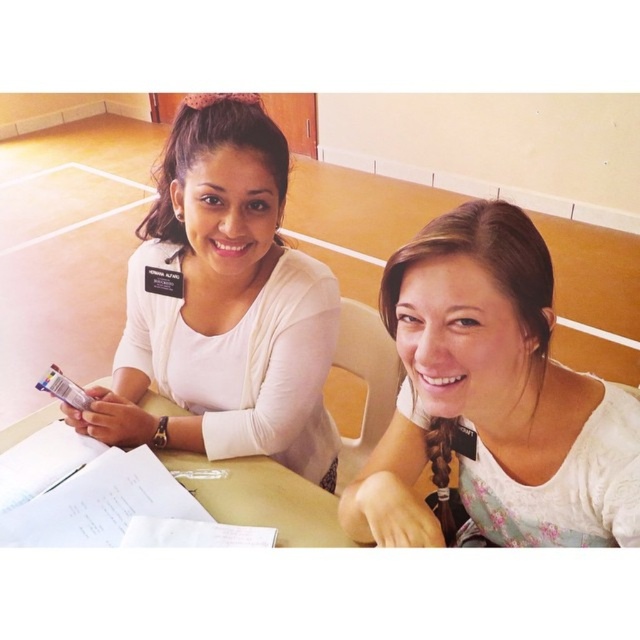
Question: Can you confirm if white floral blouse at center is thinner than light brown wooden table at center?

Choices:
 (A) no
 (B) yes

Answer: (B)

Question: Which point appears closest to the camera in this image?

Choices:
 (A) (572, 438)
 (B) (13, 444)

Answer: (A)

Question: Which of the following is the farthest from the observer?

Choices:
 (A) (284, 547)
 (B) (417, 518)

Answer: (A)

Question: Which point is farther to the camera?

Choices:
 (A) (250, 461)
 (B) (253, 172)
 (C) (504, 216)

Answer: (A)

Question: Can you confirm if white floral blouse at center is thinner than light brown wooden table at center?

Choices:
 (A) no
 (B) yes

Answer: (B)

Question: Is white floral blouse at center to the right of light brown wooden table at center from the viewer's perspective?

Choices:
 (A) no
 (B) yes

Answer: (B)